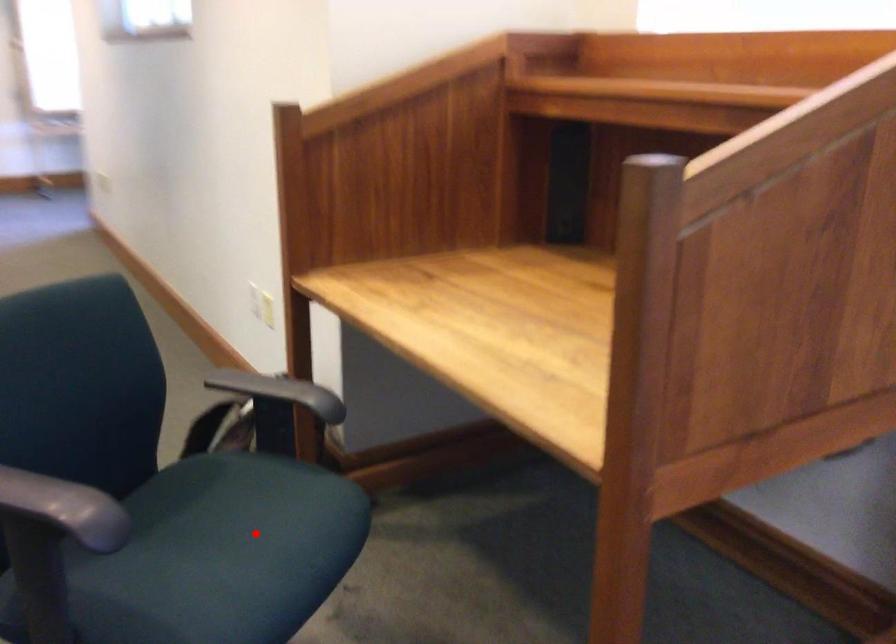
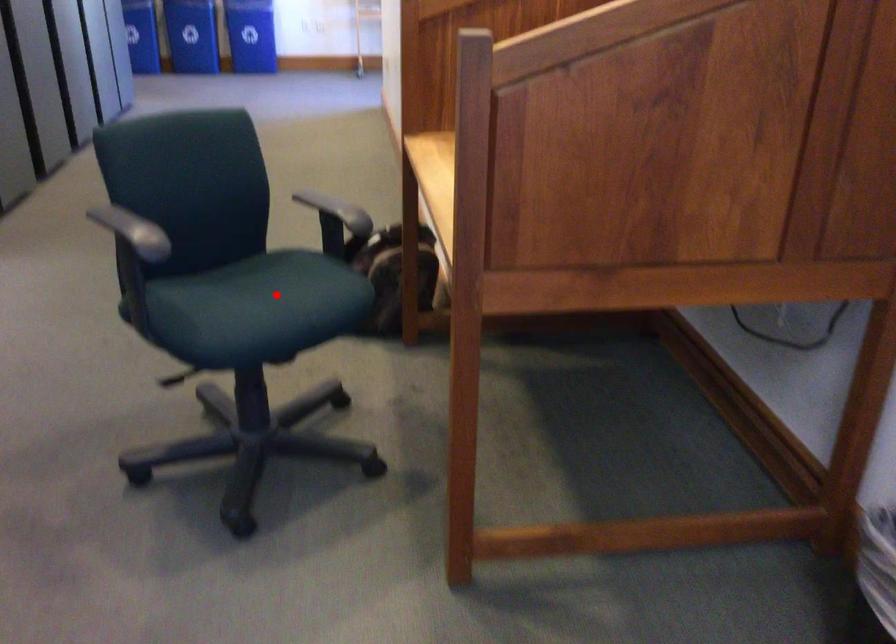
I am providing you with two images of the same scene from different viewpoints. A red point is marked on the first image and another point is marked on the second image. Do the highlighted points in image1 and image2 indicate the same real-world spot?

Yes